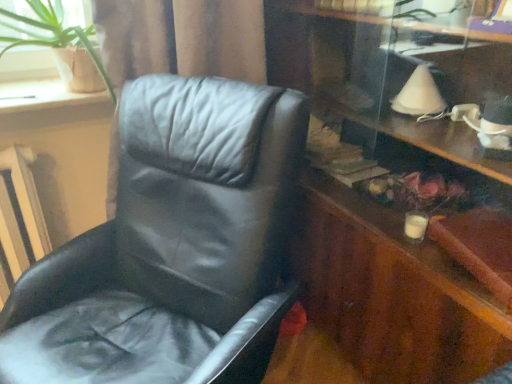
Question: Is white textured radiator at left situated inside black leather chair at left or outside?

Choices:
 (A) inside
 (B) outside

Answer: (B)

Question: Considering the positions of white textured radiator at left and black leather chair at left in the image, is white textured radiator at left wider or thinner than black leather chair at left?

Choices:
 (A) thin
 (B) wide

Answer: (A)

Question: Estimate the real-world distances between objects in this image. Which object is closer to the wooden dresser at right?

Choices:
 (A) white textured radiator at left
 (B) wooden at left
 (C) green leafy plant at upper left
 (D) black leather chair at left

Answer: (D)

Question: Which of these objects is positioned farthest from the wooden dresser at right?

Choices:
 (A) wooden at left
 (B) green leafy plant at upper left
 (C) black leather chair at left
 (D) white textured radiator at left

Answer: (D)